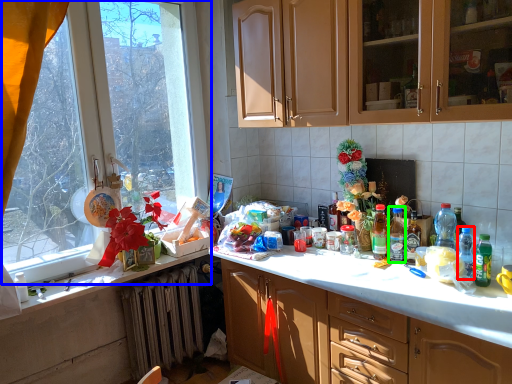
Question: Based on their relative distances, which object is farther from bottle (highlighted by a red box)? Choose from window (highlighted by a blue box) and bottle (highlighted by a green box).

Choices:
 (A) window
 (B) bottle

Answer: (A)